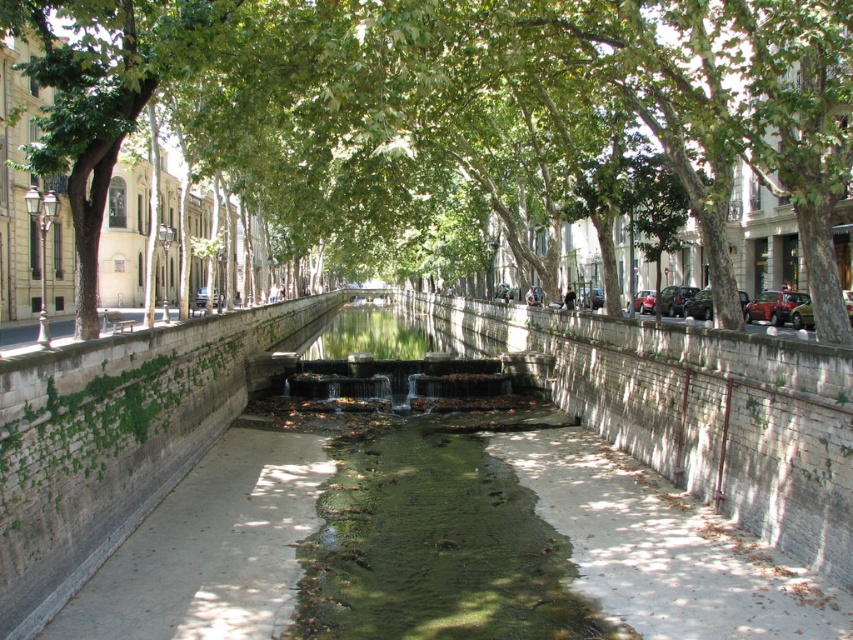
Who is positioned more to the right, green leafy tree at center or smooth concrete pavement at center?

Positioned to the right is green leafy tree at center.

Which is below, green leafy tree at center or smooth concrete pavement at center?

Positioned lower is smooth concrete pavement at center.

Who is more distant from viewer, (138, 22) or (819, 404)?

The point (138, 22) is behind.

Identify the location of green leafy tree at center. This screenshot has height=640, width=853. (461, 118).